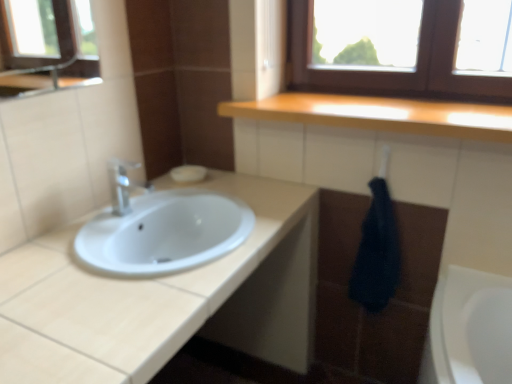
Question: Is dark blue towel at lower right beside white glossy sink at center?

Choices:
 (A) no
 (B) yes

Answer: (A)

Question: Can you confirm if dark blue towel at lower right is bigger than white glossy sink at center?

Choices:
 (A) yes
 (B) no

Answer: (B)

Question: Can we say dark blue towel at lower right lies outside white glossy sink at center?

Choices:
 (A) yes
 (B) no

Answer: (A)

Question: Are dark blue towel at lower right and white glossy sink at center located far from each other?

Choices:
 (A) no
 (B) yes

Answer: (A)

Question: Is dark blue towel at lower right in front of white glossy sink at center?

Choices:
 (A) yes
 (B) no

Answer: (B)

Question: Is dark blue towel at lower right surrounding white glossy sink at center?

Choices:
 (A) no
 (B) yes

Answer: (A)

Question: From a real-world perspective, does wooden countertop at upper center stand above white matte soap at center?

Choices:
 (A) no
 (B) yes

Answer: (B)

Question: Does wooden countertop at upper center have a greater height compared to white matte soap at center?

Choices:
 (A) yes
 (B) no

Answer: (A)

Question: Is wooden countertop at upper center not close to white matte soap at center?

Choices:
 (A) yes
 (B) no

Answer: (B)

Question: Is wooden countertop at upper center outside of white matte soap at center?

Choices:
 (A) no
 (B) yes

Answer: (B)

Question: From the image's perspective, does wooden countertop at upper center appear lower than white matte soap at center?

Choices:
 (A) yes
 (B) no

Answer: (B)

Question: Is wooden countertop at upper center facing away from white matte soap at center?

Choices:
 (A) no
 (B) yes

Answer: (A)

Question: Can you confirm if dark blue towel at lower right is shorter than white matte soap at center?

Choices:
 (A) no
 (B) yes

Answer: (A)